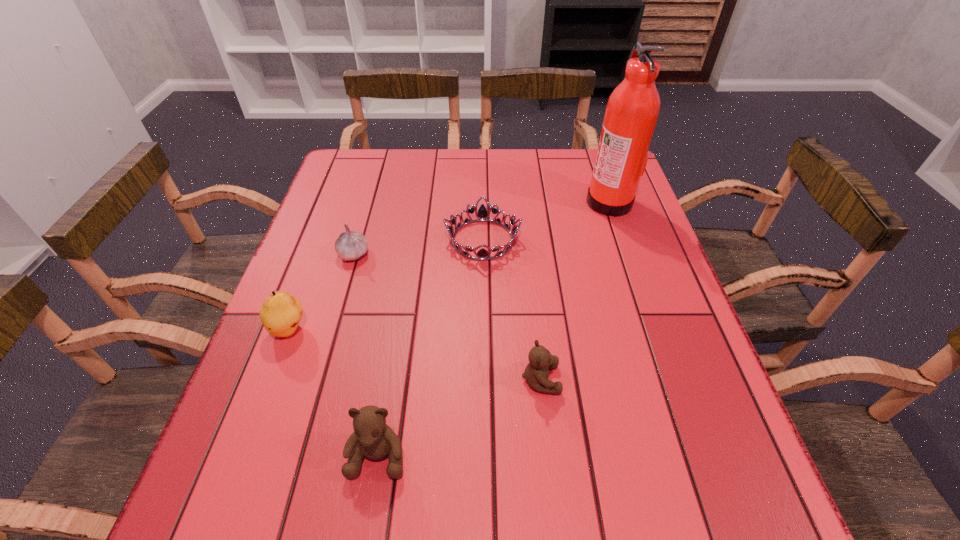
Where is `free point that keeps the teddy bears evenly spaced on the right`? free point that keeps the teddy bears evenly spaced on the right is located at coordinates (668, 320).